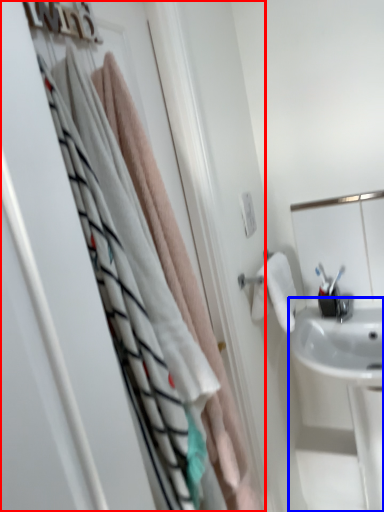
Question: Which object appears closest to the camera in this image, closet (highlighted by a red box) or sink (highlighted by a blue box)?

Choices:
 (A) closet
 (B) sink

Answer: (A)